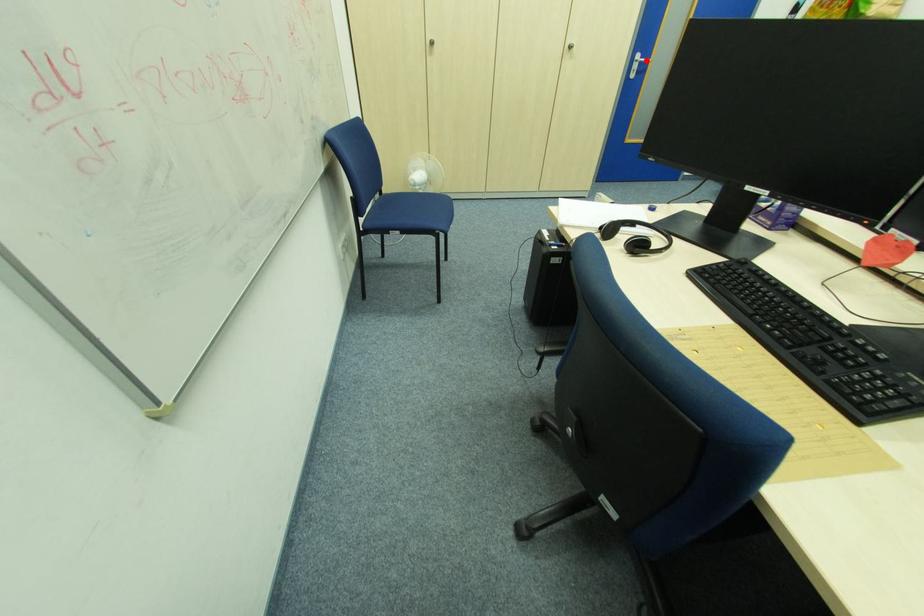
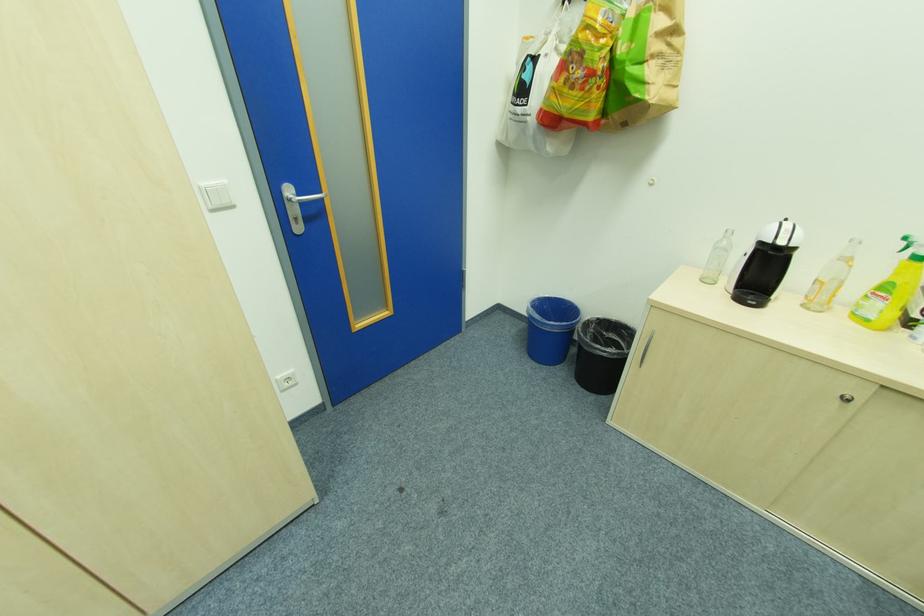
Locate, in the second image, the point that corresponds to the highlighted location in the first image.

(304, 196)